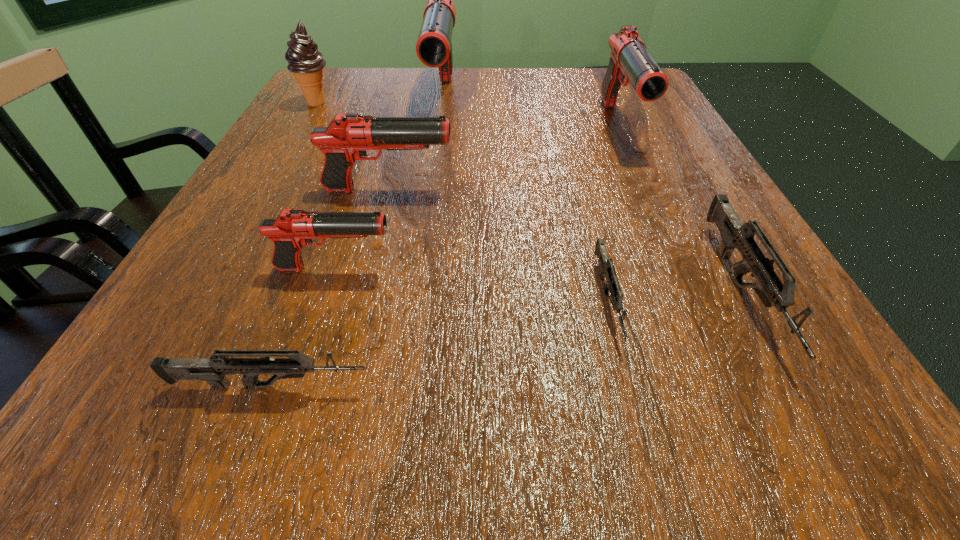
Identify the location of the tallest gun. (434, 47).

The height and width of the screenshot is (540, 960). I want to click on the tallest object, so click(434, 47).

Where is `the second biggest black gun`? The image size is (960, 540). the second biggest black gun is located at coordinates (629, 57).

This screenshot has width=960, height=540. Identify the location of the second object from right to left. (629, 57).

I want to click on icecream, so click(x=306, y=63).

The width and height of the screenshot is (960, 540). What are the coordinates of `the fifth shortest gun` in the screenshot? It's located at (346, 139).

Locate an element on the screen. This screenshot has width=960, height=540. the fourth farthest object is located at coordinates (346, 139).

Locate an element on the screen. This screenshot has height=540, width=960. the nearest black gun is located at coordinates (292, 229).

Locate an element on the screen. the fourth shortest gun is located at coordinates (292, 229).

Locate an element on the screen. The image size is (960, 540). the rightmost grey gun is located at coordinates (735, 234).